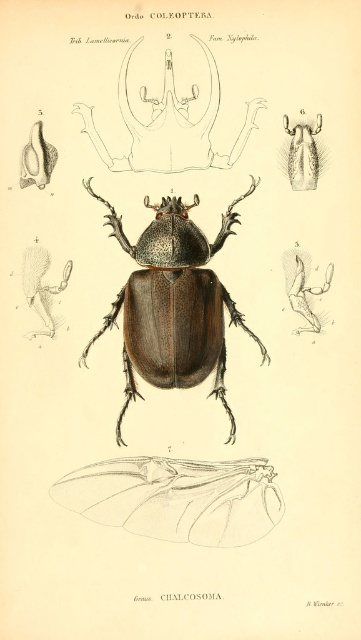
Question: Which point appears closest to the camera in this image?

Choices:
 (A) (133, 324)
 (B) (310, 124)
 (C) (174, 483)

Answer: (B)

Question: Which of these objects is positioned closest to the matte brown beetle at center?

Choices:
 (A) transparent paper wing at lower center
 (B) matte black mandibles at upper center

Answer: (B)

Question: Does matte brown beetle at center have a larger size compared to matte black mandibles at upper center?

Choices:
 (A) yes
 (B) no

Answer: (A)

Question: Considering the relative positions of transparent paper wing at lower center and fuzzy brown wing at upper center in the image provided, where is transparent paper wing at lower center located with respect to fuzzy brown wing at upper center?

Choices:
 (A) left
 (B) right

Answer: (A)

Question: Among these objects, which one is farthest from the camera?

Choices:
 (A) matte black mandibles at upper center
 (B) matte brown beetle at center

Answer: (B)

Question: Where is matte brown beetle at center located in relation to transparent paper wing at lower center in the image?

Choices:
 (A) below
 (B) above

Answer: (B)